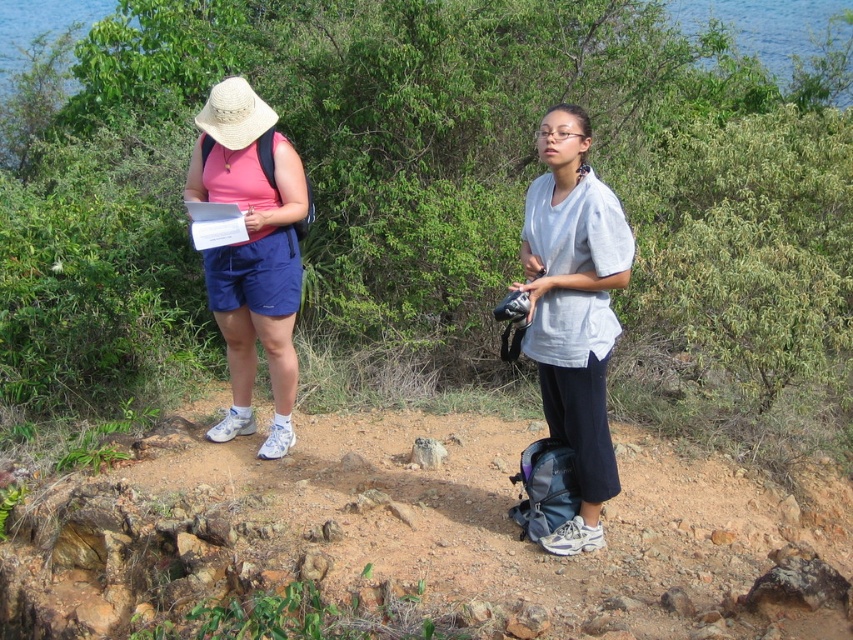
Does light gray cotton shirt at center appear over matte pink shirt at left?

Actually, light gray cotton shirt at center is below matte pink shirt at left.

Is point (560, 124) positioned in front of point (260, 253)?

That is True.

Is point (572, 426) closer to viewer compared to point (206, 264)?

Yes, point (572, 426) is closer to viewer.

What are the coordinates of `light gray cotton shirt at center` in the screenshot? It's located at (573, 308).